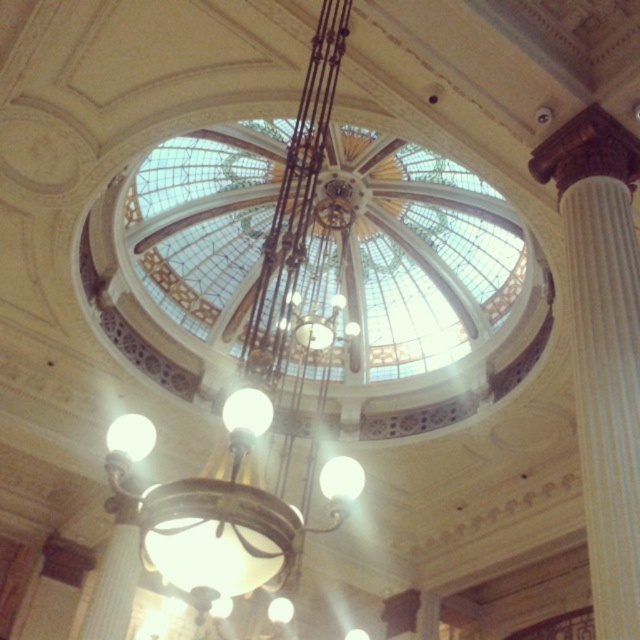
Question: Among these points, which one is farthest from the camera?

Choices:
 (A) (317, 160)
 (B) (604, 456)

Answer: (A)

Question: Which point is farther to the camera?

Choices:
 (A) (588, 381)
 (B) (147, 500)

Answer: (A)

Question: Is metallic chandelier at center positioned before white marble column at right?

Choices:
 (A) yes
 (B) no

Answer: (B)

Question: Which point appears farthest from the camera in this image?

Choices:
 (A) (164, 512)
 (B) (538, 180)

Answer: (B)

Question: Can you confirm if metallic chandelier at center is positioned to the right of white marble column at right?

Choices:
 (A) no
 (B) yes

Answer: (A)

Question: Is metallic chandelier at center thinner than white marble column at right?

Choices:
 (A) yes
 (B) no

Answer: (B)